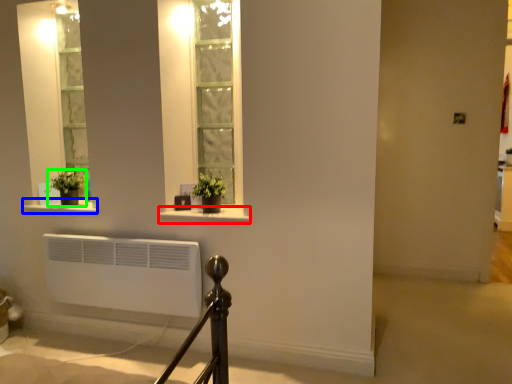
Question: Considering the real-world distances, which object is farthest from window sill (highlighted by a red box)? window sill (highlighted by a blue box) or houseplant (highlighted by a green box)?

Choices:
 (A) window sill
 (B) houseplant

Answer: (B)